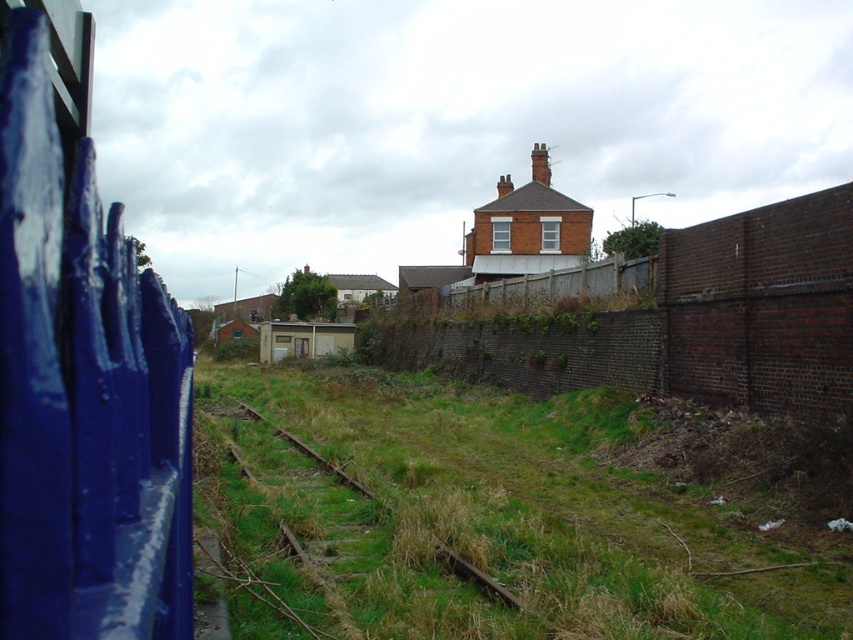
Question: Does brick wall at center appear under green grassy train track at center?

Choices:
 (A) yes
 (B) no

Answer: (B)

Question: Which is nearer to the green grass at center?

Choices:
 (A) green grassy train track at center
 (B) blue painted wood fence at left
 (C) brick wall at center

Answer: (A)

Question: Does blue painted wood fence at left have a lesser width compared to brick wall at center?

Choices:
 (A) yes
 (B) no

Answer: (A)

Question: Which point is farther to the camera?

Choices:
 (A) green grassy train track at center
 (B) blue painted wood fence at left
 (C) brick wall at center
 (D) green grass at center

Answer: (C)

Question: Can you confirm if blue painted wood fence at left is positioned above brick wall at center?

Choices:
 (A) yes
 (B) no

Answer: (A)

Question: Which object appears farthest from the camera in this image?

Choices:
 (A) green grass at center
 (B) green grassy train track at center
 (C) brick wall at center
 (D) blue painted wood fence at left

Answer: (C)